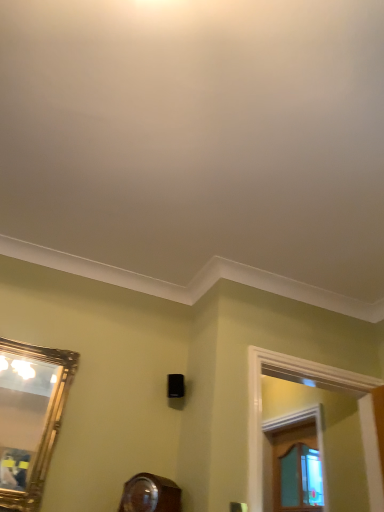
Question: From the image's perspective, is gold-framed mirror at left on white wood window frame at upper right, placed as the second window frame when sorted from back to front?

Choices:
 (A) yes
 (B) no

Answer: (A)

Question: Is gold-framed mirror at left at the left side of white wood window frame at upper right, placed as the second window frame when sorted from back to front?

Choices:
 (A) no
 (B) yes

Answer: (B)

Question: Could white wood window frame at upper right, the first window frame from the front, be considered to be inside gold-framed mirror at left?

Choices:
 (A) yes
 (B) no

Answer: (B)

Question: Does gold-framed mirror at left appear on the right side of white wood window frame at upper right, placed as the second window frame when sorted from back to front?

Choices:
 (A) yes
 (B) no

Answer: (B)

Question: Considering the relative sizes of gold-framed mirror at left and white wood window frame at upper right, placed as the second window frame when sorted from back to front, in the image provided, is gold-framed mirror at left thinner than white wood window frame at upper right, placed as the second window frame when sorted from back to front,?

Choices:
 (A) no
 (B) yes

Answer: (B)

Question: Looking at their shapes, would you say gold-framed mirror at left is wider or thinner than white wood window frame at upper right, placed as the second window frame when sorted from back to front?

Choices:
 (A) thin
 (B) wide

Answer: (A)

Question: From the image's perspective, is gold-framed mirror at left located above or below white wood window frame at upper right, placed as the second window frame when sorted from back to front?

Choices:
 (A) above
 (B) below

Answer: (A)

Question: In terms of size, does gold-framed mirror at left appear bigger or smaller than white wood window frame at upper right, placed as the second window frame when sorted from back to front?

Choices:
 (A) big
 (B) small

Answer: (B)

Question: Do you think gold-framed mirror at left is within white wood window frame at upper right, placed as the second window frame when sorted from back to front, or outside of it?

Choices:
 (A) outside
 (B) inside

Answer: (A)

Question: Considering the positions of wooden window frame at right, the 2th window frame viewed from the front, and gold-framed mirror at left in the image, is wooden window frame at right, the 2th window frame viewed from the front, wider or thinner than gold-framed mirror at left?

Choices:
 (A) thin
 (B) wide

Answer: (B)

Question: In terms of size, does wooden window frame at right, which ranks as the first window frame in back-to-front order, appear bigger or smaller than gold-framed mirror at left?

Choices:
 (A) big
 (B) small

Answer: (A)

Question: From the image's perspective, is wooden window frame at right, the 2th window frame viewed from the front, above or below gold-framed mirror at left?

Choices:
 (A) below
 (B) above

Answer: (A)

Question: In terms of height, does wooden window frame at right, which ranks as the first window frame in back-to-front order, look taller or shorter compared to gold-framed mirror at left?

Choices:
 (A) tall
 (B) short

Answer: (B)

Question: From a real-world perspective, relative to white wood window frame at upper right, placed as the second window frame when sorted from back to front, is wooden window frame at right, which ranks as the first window frame in back-to-front order, vertically above or below?

Choices:
 (A) above
 (B) below

Answer: (A)

Question: Is point (322, 449) closer or farther from the camera than point (256, 501)?

Choices:
 (A) farther
 (B) closer

Answer: (A)